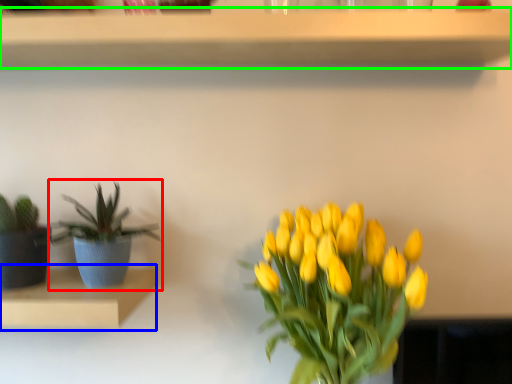
Question: Which object is the farthest from houseplant (highlighted by a red box)? Choose among these: shelf (highlighted by a blue box) or shelf (highlighted by a green box).

Choices:
 (A) shelf
 (B) shelf

Answer: (B)